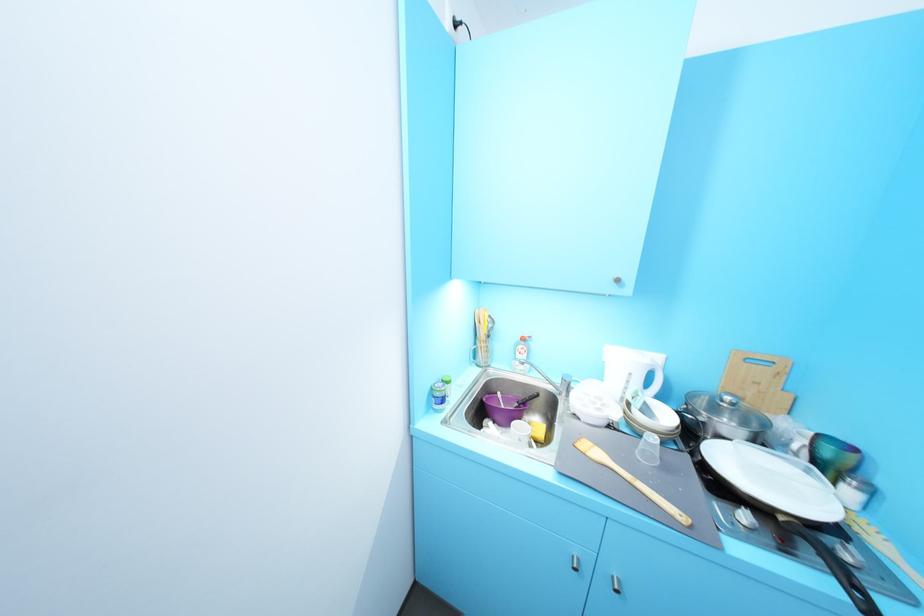
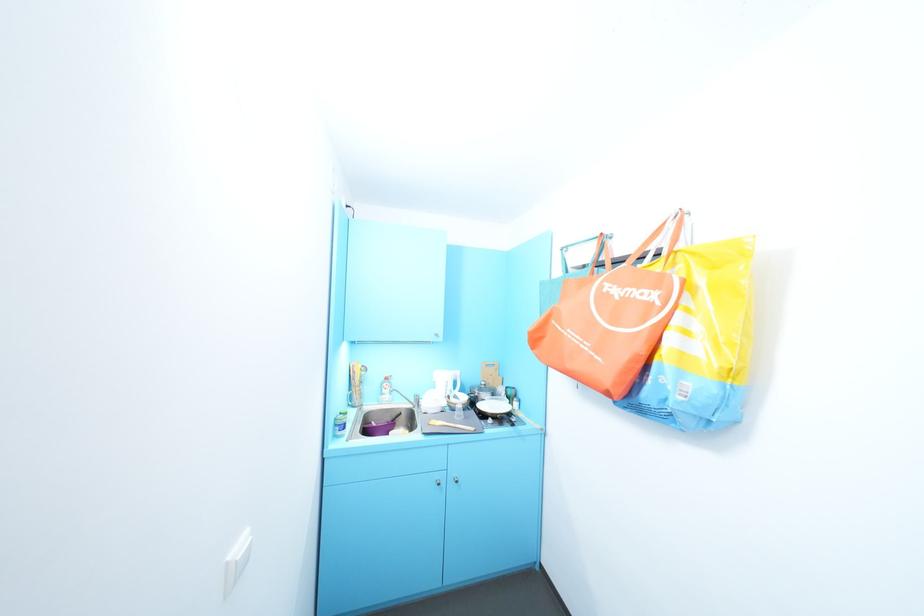
Where in the second image is the point corresponding to point (742, 536) from the first image?

(494, 428)